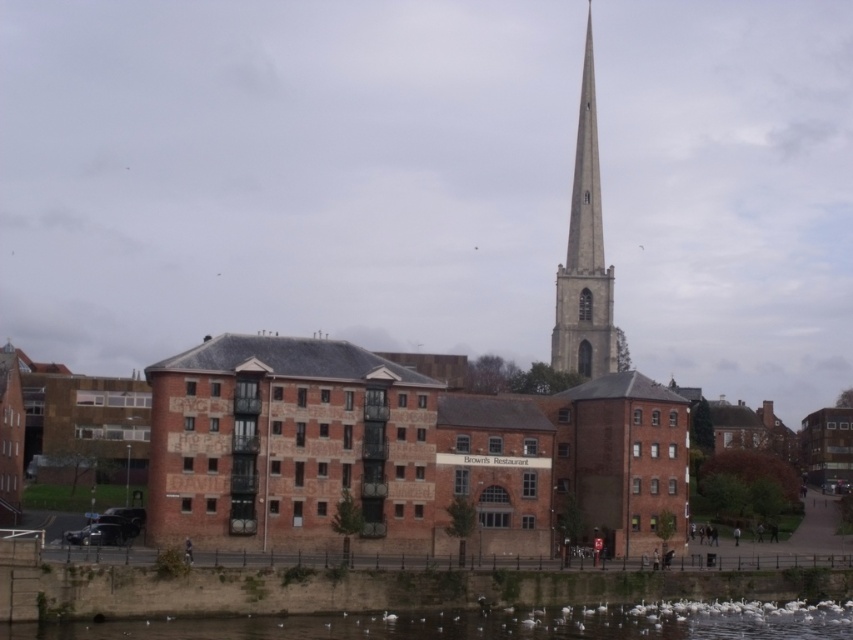
Question: Estimate the real-world distances between objects in this image. Which object is farther from the smooth stone spire at center?

Choices:
 (A) brick building at center
 (B) white fluffy birds at lower center

Answer: (B)

Question: Is white fluffy birds at lower center wider than smooth stone spire at center?

Choices:
 (A) yes
 (B) no

Answer: (A)

Question: From the image, what is the correct spatial relationship of white fluffy birds at lower center in relation to smooth stone spire at center?

Choices:
 (A) left
 (B) right

Answer: (A)

Question: Can you confirm if brick building at center is positioned above smooth stone spire at center?

Choices:
 (A) no
 (B) yes

Answer: (A)

Question: Based on their relative distances, which object is farther from the brick building at center?

Choices:
 (A) white fluffy birds at lower center
 (B) smooth stone spire at center

Answer: (B)

Question: Which is nearer to the white fluffy birds at lower center?

Choices:
 (A) brick building at center
 (B) smooth stone spire at center

Answer: (A)